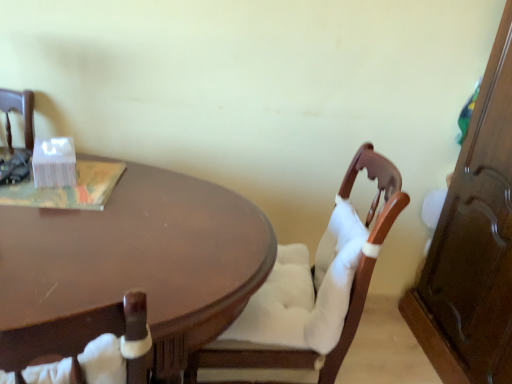
Question: From a real-world perspective, is white fabric chair at center physically located above or below shiny brown table at center?

Choices:
 (A) below
 (B) above

Answer: (B)

Question: Considering the positions of white fabric chair at center and shiny brown table at center in the image, is white fabric chair at center bigger or smaller than shiny brown table at center?

Choices:
 (A) big
 (B) small

Answer: (B)

Question: Is white fabric chair at center in front of or behind shiny brown table at center in the image?

Choices:
 (A) behind
 (B) front

Answer: (A)

Question: Would you say shiny brown table at center is to the left or to the right of white fabric chair at center in the picture?

Choices:
 (A) left
 (B) right

Answer: (A)

Question: Considering the positions of shiny brown table at center and white fabric chair at center in the image, is shiny brown table at center wider or thinner than white fabric chair at center?

Choices:
 (A) wide
 (B) thin

Answer: (A)

Question: Is shiny brown table at center in front of or behind white fabric chair at center in the image?

Choices:
 (A) front
 (B) behind

Answer: (A)

Question: In terms of height, does shiny brown table at center look taller or shorter compared to white fabric chair at center?

Choices:
 (A) short
 (B) tall

Answer: (A)